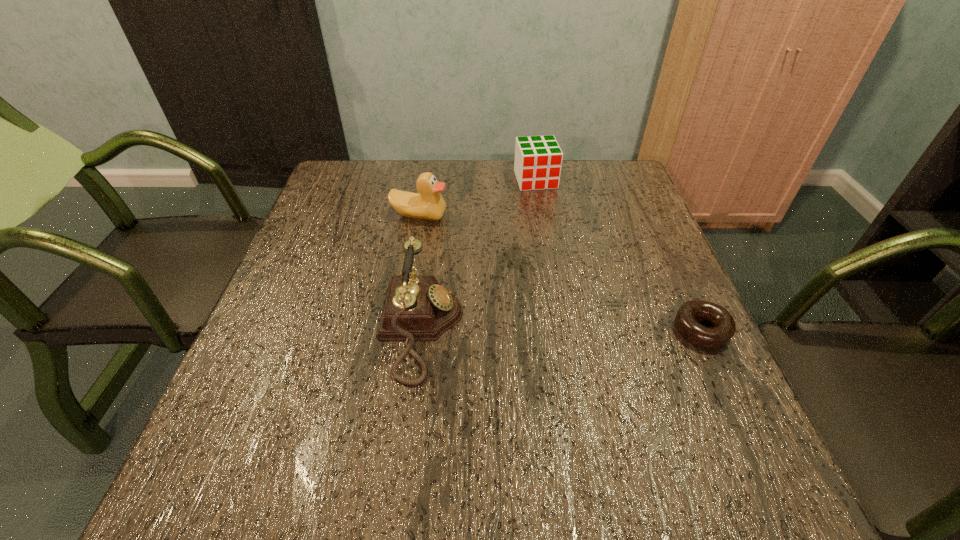
Where is `telephone`? telephone is located at coordinates (417, 308).

Locate an element on the screen. the shortest object is located at coordinates [x=724, y=327].

Identify the location of the rightmost object. This screenshot has height=540, width=960. (724, 327).

Identify the location of the third nearest object. This screenshot has height=540, width=960. (428, 204).

Where is `cube`? The image size is (960, 540). cube is located at coordinates (538, 160).

Find the location of a particular element. the second object from right to left is located at coordinates (538, 160).

Locate an element on the screen. vacant space located 0.060m on the dial of the tallest object is located at coordinates (492, 329).

Locate an element on the screen. vacant space situated on the front of the doughnut is located at coordinates (x=751, y=435).

This screenshot has width=960, height=540. In order to click on blank space located 0.190m at the beak of the duck in this screenshot , I will do `click(472, 265)`.

This screenshot has width=960, height=540. Find the location of `vacant space located 0.240m at the beak of the duck`. vacant space located 0.240m at the beak of the duck is located at coordinates (484, 278).